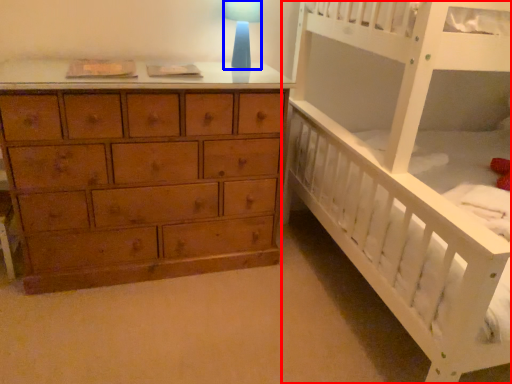
Question: Among these objects, which one is farthest to the camera, infant bed (highlighted by a red box) or table lamp (highlighted by a blue box)?

Choices:
 (A) infant bed
 (B) table lamp

Answer: (B)